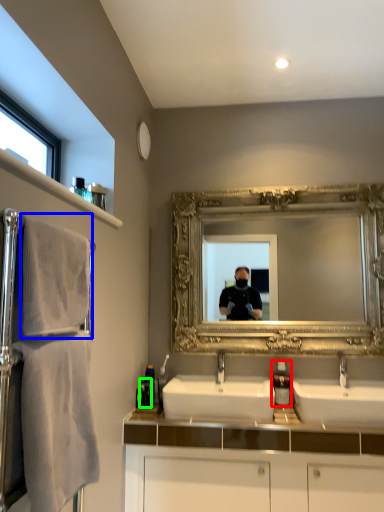
Question: Which object is positioned farthest from soap dispenser (highlighted by a red box)? Select from bath towel (highlighted by a blue box) and toiletry (highlighted by a green box).

Choices:
 (A) bath towel
 (B) toiletry

Answer: (A)